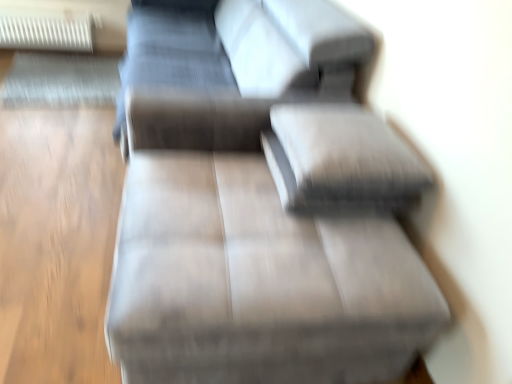
Question: Is white plastic radiator at upper left smaller than textured gray pillow at center?

Choices:
 (A) yes
 (B) no

Answer: (B)

Question: Does white plastic radiator at upper left appear on the left side of textured gray pillow at center?

Choices:
 (A) no
 (B) yes

Answer: (B)

Question: From the image's perspective, is white plastic radiator at upper left on textured gray pillow at center?

Choices:
 (A) no
 (B) yes

Answer: (B)

Question: Is white plastic radiator at upper left further to the viewer compared to textured gray pillow at center?

Choices:
 (A) yes
 (B) no

Answer: (A)

Question: Considering the relative positions of white plastic radiator at upper left and textured gray pillow at center in the image provided, is white plastic radiator at upper left to the right of textured gray pillow at center from the viewer's perspective?

Choices:
 (A) yes
 (B) no

Answer: (B)

Question: Is white plastic radiator at upper left in front of or behind textured gray pillow at center in the image?

Choices:
 (A) front
 (B) behind

Answer: (B)

Question: Considering the positions of point (80, 41) and point (304, 180), is point (80, 41) closer or farther from the camera than point (304, 180)?

Choices:
 (A) farther
 (B) closer

Answer: (A)

Question: In terms of width, does white plastic radiator at upper left look wider or thinner when compared to textured gray pillow at center?

Choices:
 (A) wide
 (B) thin

Answer: (B)

Question: In terms of height, does white plastic radiator at upper left look taller or shorter compared to textured gray pillow at center?

Choices:
 (A) short
 (B) tall

Answer: (B)

Question: In terms of size, does white plastic radiator at upper left appear bigger or smaller than matte gray couch at center?

Choices:
 (A) big
 (B) small

Answer: (B)

Question: Considering the positions of white plastic radiator at upper left and matte gray couch at center in the image, is white plastic radiator at upper left taller or shorter than matte gray couch at center?

Choices:
 (A) tall
 (B) short

Answer: (B)

Question: Is point (60, 29) positioned closer to the camera than point (177, 144)?

Choices:
 (A) closer
 (B) farther

Answer: (B)

Question: Looking at their shapes, would you say white plastic radiator at upper left is wider or thinner than matte gray couch at center?

Choices:
 (A) wide
 (B) thin

Answer: (B)

Question: Is matte gray couch at center wider or thinner than white plastic radiator at upper left?

Choices:
 (A) thin
 (B) wide

Answer: (B)

Question: Looking at the image, does matte gray couch at center seem bigger or smaller compared to white plastic radiator at upper left?

Choices:
 (A) small
 (B) big

Answer: (B)